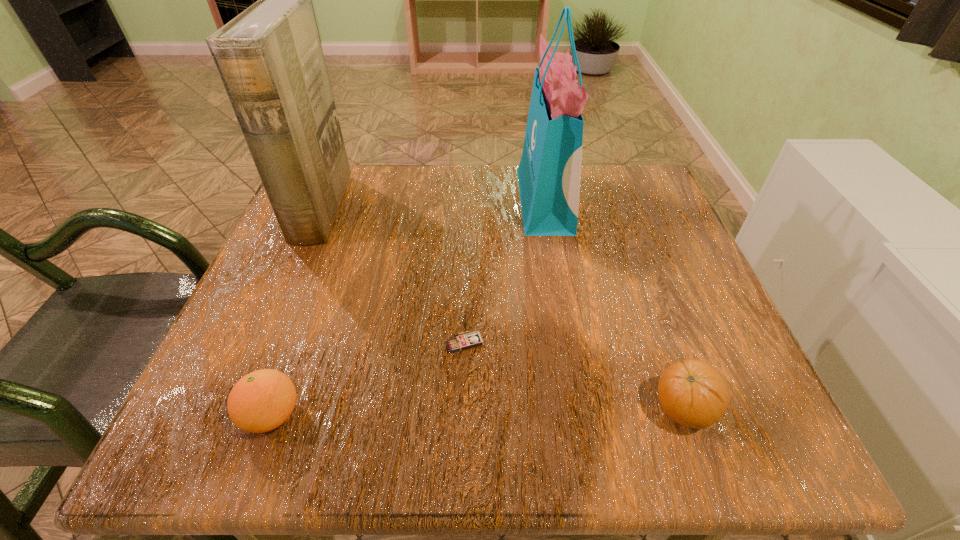
You are a GUI agent. You are given a task and a screenshot of the screen. Output one action in this format:
    pyautogui.click(x=<x>, y=<y>)
    Task: Click on the free point that satisfies the following two spatial constraints: 1. on the cover of the left orange; 2. on the left side of the phonebook
    This screenshot has width=960, height=540.
    Given the screenshot: What is the action you would take?
    pyautogui.click(x=233, y=415)

This screenshot has width=960, height=540. What are the coordinates of `free spot that satisfies the following two spatial constraints: 1. on the back side of the rightmost object; 2. on the left side of the left orange` in the screenshot? It's located at (275, 409).

Locate an element on the screen. The image size is (960, 540). free space that satisfies the following two spatial constraints: 1. on the cover of the third object from right to left; 2. on the left side of the phonebook is located at coordinates (264, 342).